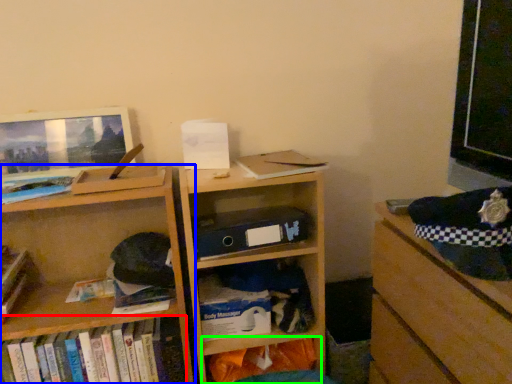
Question: Which is nearer to the book (highlighted by a red box)? shelf (highlighted by a blue box) or shelf (highlighted by a green box).

Choices:
 (A) shelf
 (B) shelf

Answer: (A)